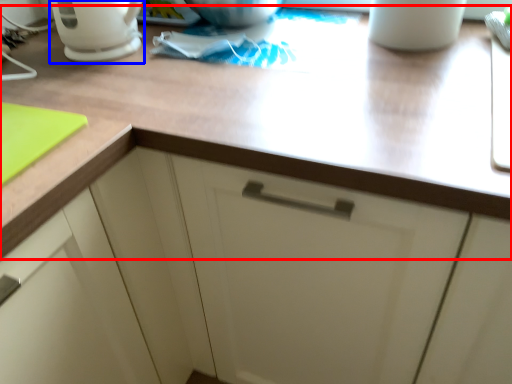
Question: Among these objects, which one is nearest to the camera, countertop (highlighted by a red box) or coffeepot (highlighted by a blue box)?

Choices:
 (A) countertop
 (B) coffeepot

Answer: (A)